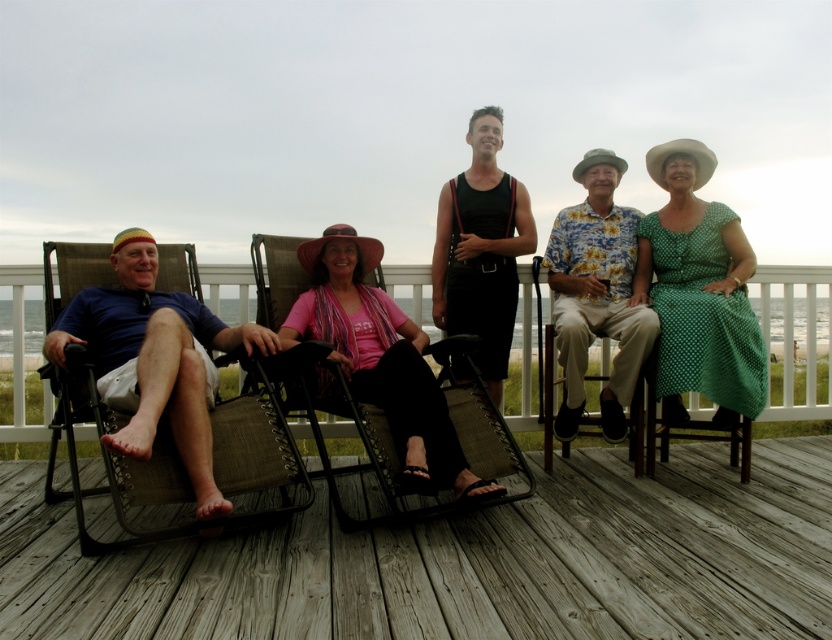
Question: Does brown woven beach chair at left appear on the right side of pink fabric dress at center?

Choices:
 (A) yes
 (B) no

Answer: (B)

Question: Among these points, which one is farthest from the camera?

Choices:
 (A) (632, 586)
 (B) (726, 362)

Answer: (B)

Question: Is brown woven beach chair at left wider than floral shirt at center?

Choices:
 (A) yes
 (B) no

Answer: (A)

Question: Estimate the real-world distances between objects in this image. Which object is farther from the brown woven beach chair at left?

Choices:
 (A) pink fabric dress at center
 (B) brown woven deck at center

Answer: (B)

Question: Among these points, which one is nearest to the camera?

Choices:
 (A) click(499, 355)
 (B) click(635, 333)
 (C) click(644, 228)

Answer: (B)

Question: Is brown woven beach chair at left thinner than pink fabric dress at center?

Choices:
 (A) yes
 (B) no

Answer: (B)